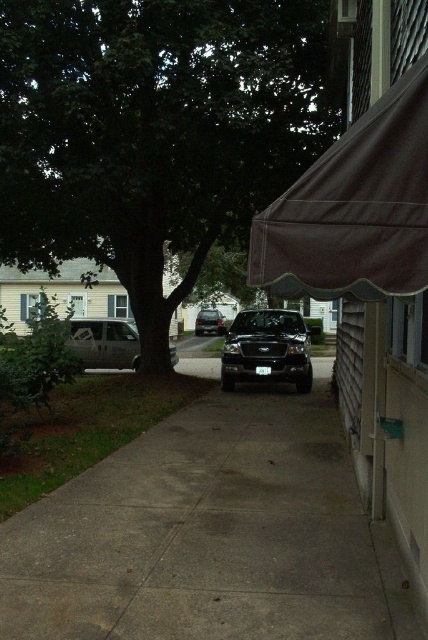
From the picture: Can you confirm if gray concrete pavement at center is positioned above black matte truck at center?

Incorrect, gray concrete pavement at center is not positioned above black matte truck at center.

Image resolution: width=428 pixels, height=640 pixels. In order to click on gray concrete pavement at center in this screenshot , I will do `click(211, 532)`.

Locate an element on the screen. gray concrete pavement at center is located at coordinates (211, 532).

Is black matte truck at center taller than silver metallic van at left?

Correct, black matte truck at center is much taller as silver metallic van at left.

Is black matte truck at center bigger than silver metallic van at left?

Indeed, black matte truck at center has a larger size compared to silver metallic van at left.

Which is in front, point (300, 324) or point (91, 317)?

Positioned in front is point (300, 324).

The height and width of the screenshot is (640, 428). I want to click on black matte truck at center, so click(267, 348).

Is green leafy tree at center taller than silver metallic van at left?

Yes, green leafy tree at center is taller than silver metallic van at left.

How much distance is there between green leafy tree at center and silver metallic van at left?

green leafy tree at center is 12.96 feet from silver metallic van at left.

Is point (38, 192) more distant than point (83, 368)?

Yes, point (38, 192) is behind point (83, 368).

Locate an element on the screen. This screenshot has width=428, height=640. green leafy tree at center is located at coordinates (152, 132).